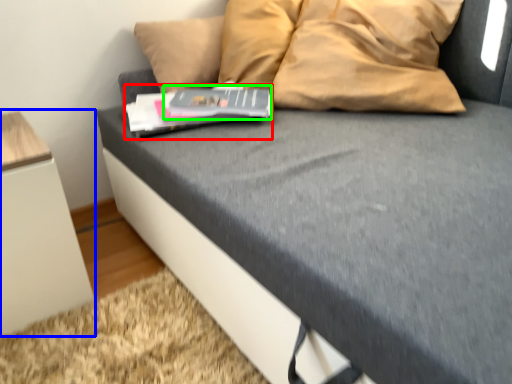
Question: Based on their relative distances, which object is nearer to paperback book (highlighted by a red box)? Choose from furniture (highlighted by a blue box) and paperback book (highlighted by a green box).

Choices:
 (A) furniture
 (B) paperback book

Answer: (B)